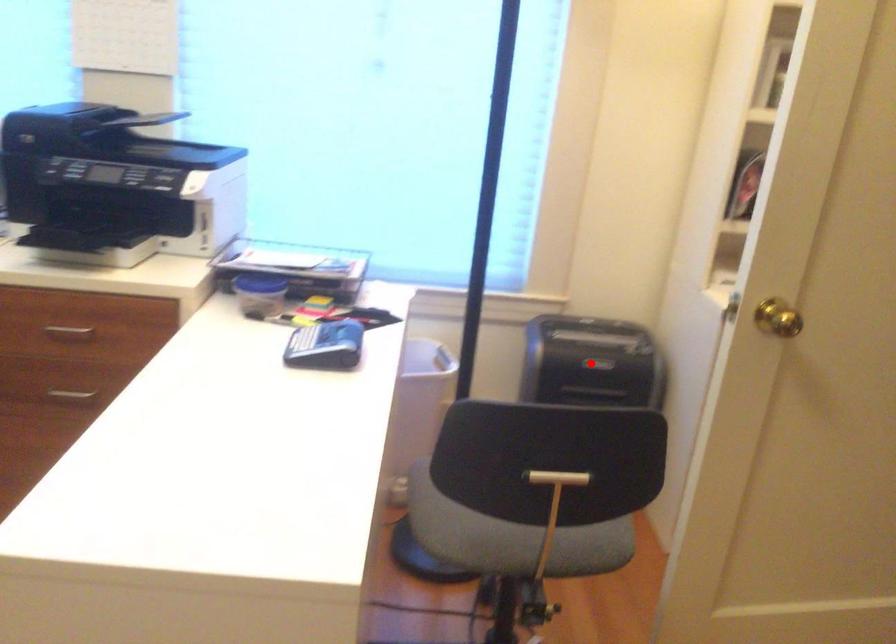
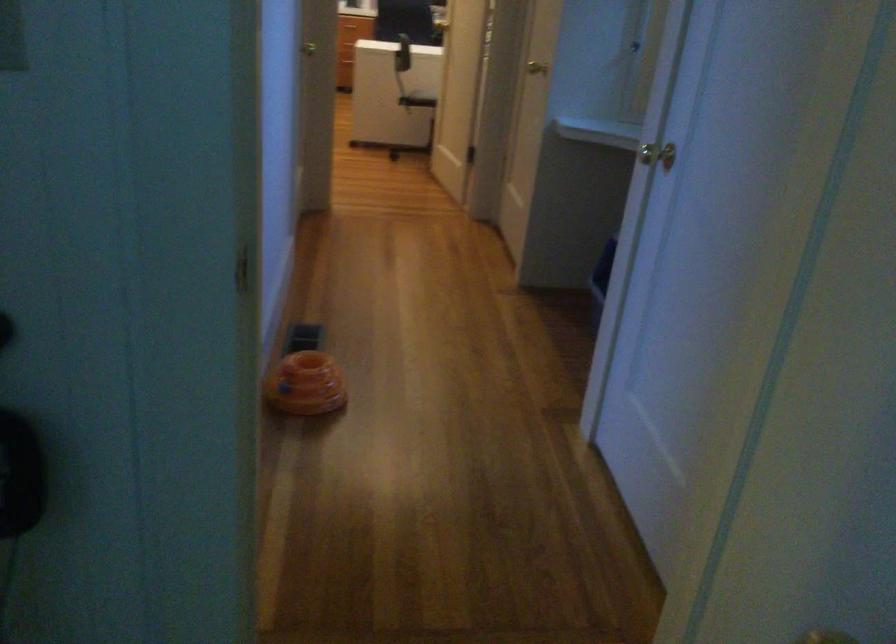
Question: I am providing you with two images of the same scene from different viewpoints. A red point is marked on the first image. Can you still see the location of the red point in image 2?

Choices:
 (A) Yes
 (B) No

Answer: (B)